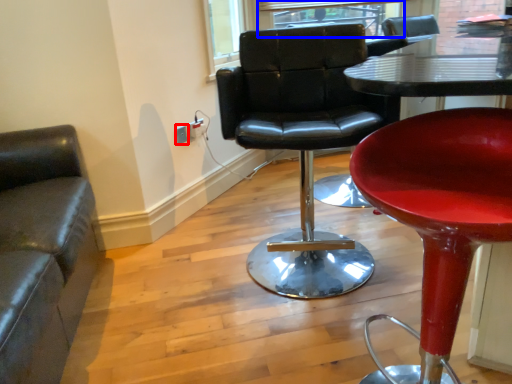
Question: Which of the following is the closest to the observer, electric outlet (highlighted by a red box) or window (highlighted by a blue box)?

Choices:
 (A) electric outlet
 (B) window

Answer: (A)